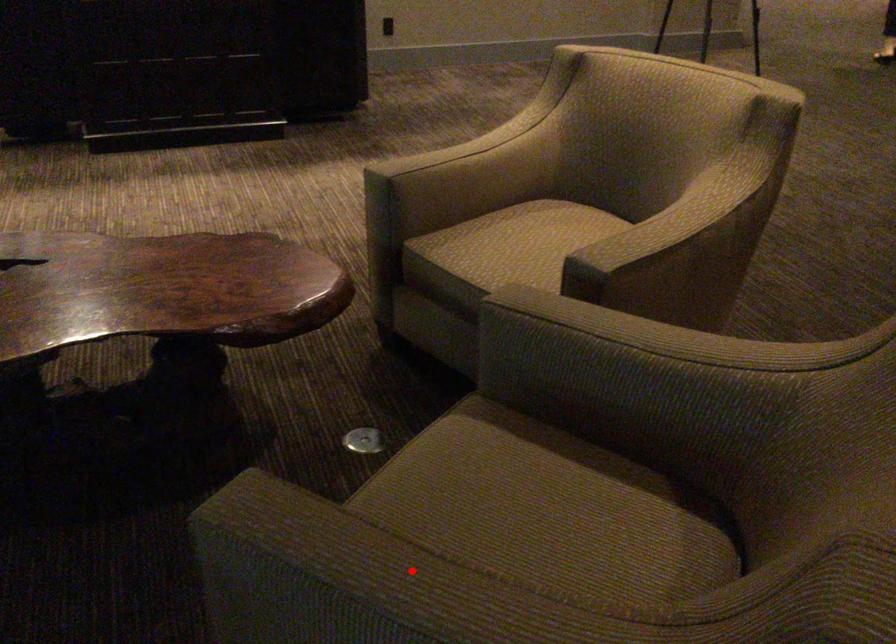
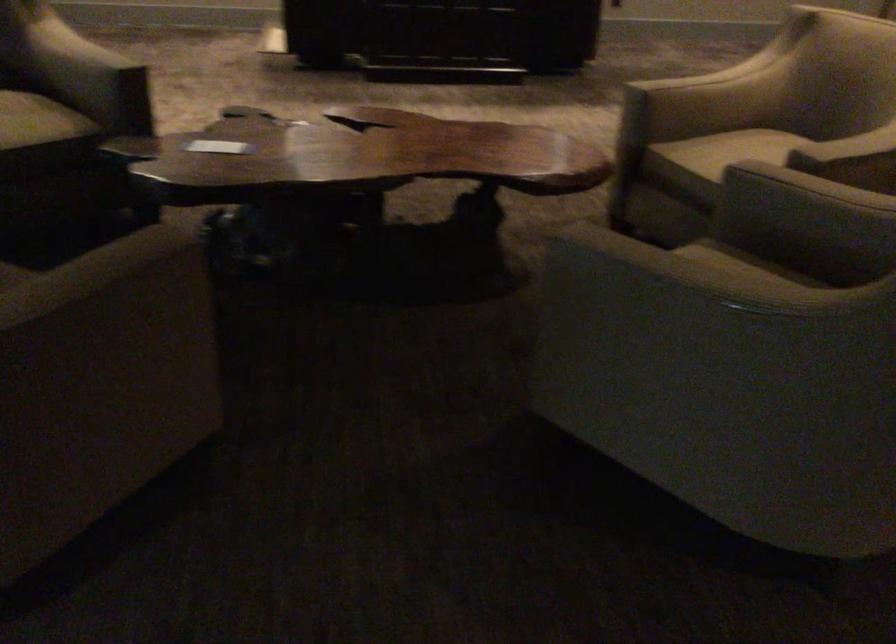
Question: I am providing you with two images of the same scene from different viewpoints. Image1 has a red point marked. In image2, the corresponding 3D location appears at what relative position? Reply with the corresponding letter.

Choices:
 (A) Closer
 (B) Farther

Answer: (B)